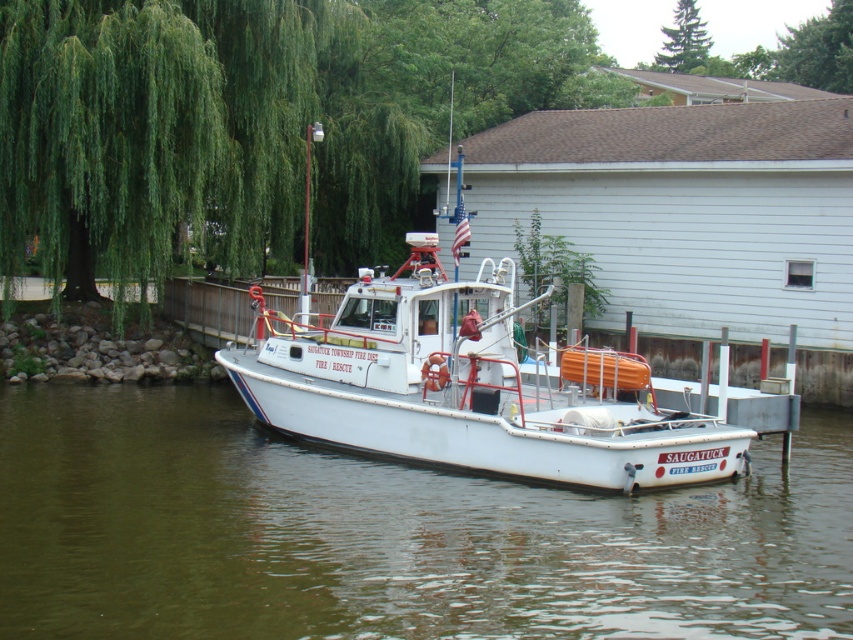
Question: Which point is closer to the camera?

Choices:
 (A) white smooth water at center
 (B) white matte boat at center

Answer: (A)

Question: Can you confirm if white smooth water at center is smaller than green leafy tree at upper center?

Choices:
 (A) no
 (B) yes

Answer: (B)

Question: Which point is closer to the camera?

Choices:
 (A) white matte boat at center
 (B) green leafy tree at upper center
 (C) white smooth water at center

Answer: (C)

Question: Among these objects, which one is nearest to the camera?

Choices:
 (A) green leafy tree at upper center
 (B) white smooth water at center

Answer: (B)

Question: Can you confirm if white smooth water at center is bigger than white matte boat at center?

Choices:
 (A) yes
 (B) no

Answer: (A)

Question: Can you confirm if white smooth water at center is positioned below white matte boat at center?

Choices:
 (A) yes
 (B) no

Answer: (A)